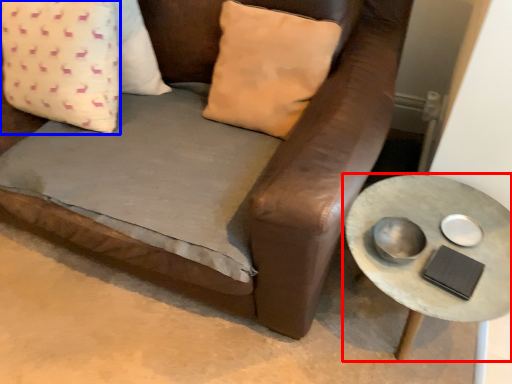
Question: Which of the following is the farthest to the observer, table (highlighted by a red box) or pillow (highlighted by a blue box)?

Choices:
 (A) table
 (B) pillow

Answer: (B)